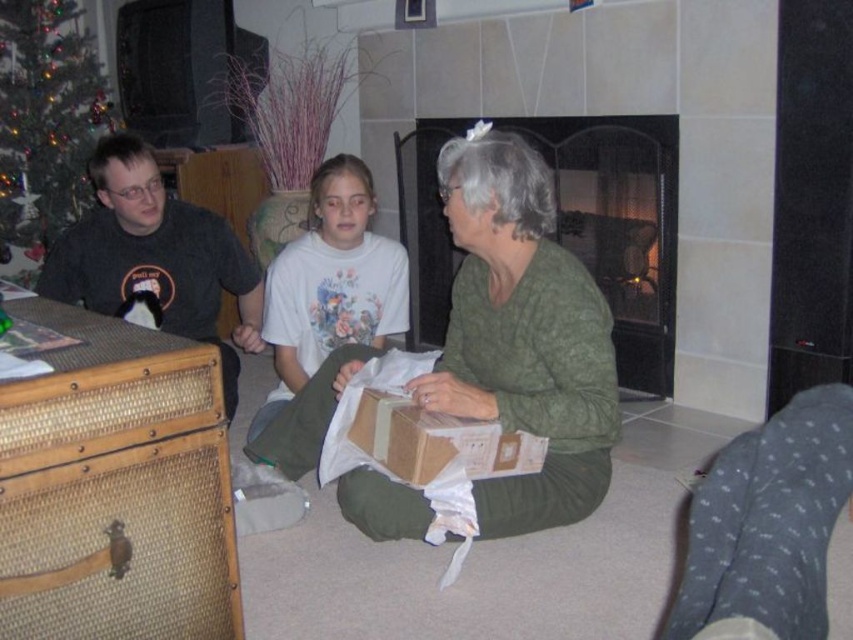
Question: Is matte black shirt at left closer to the viewer compared to green matte christmas tree at left?

Choices:
 (A) yes
 (B) no

Answer: (A)

Question: Which object is the closest to the matte cardboard box at center?

Choices:
 (A) green fabric fireplace at center
 (B) green textured sweater at center
 (C) gray dotted socks at lower right

Answer: (B)

Question: Which of the following is the closest to the observer?

Choices:
 (A) green matte christmas tree at left
 (B) green textured sweater at center
 (C) green fabric fireplace at center

Answer: (B)

Question: Is matte black shirt at left to the left of matte cardboard box at center from the viewer's perspective?

Choices:
 (A) yes
 (B) no

Answer: (A)

Question: Is white cotton shirt at center above matte cardboard box at center?

Choices:
 (A) yes
 (B) no

Answer: (A)

Question: Among these points, which one is farthest from the camera?

Choices:
 (A) (379, 436)
 (B) (432, 401)

Answer: (A)